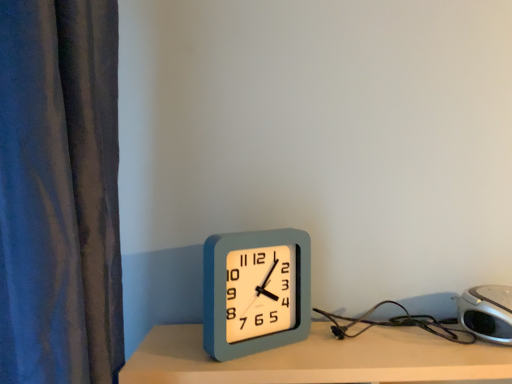
Question: Do you think light blue plastic clock at center, which ranks as the 1th alarm clock in left-to-right order, is within silver metallic alarm clock at lower right, which is the second alarm clock in left-to-right order, or outside of it?

Choices:
 (A) outside
 (B) inside

Answer: (A)

Question: Does point (282, 332) appear closer or farther from the camera than point (501, 306)?

Choices:
 (A) farther
 (B) closer

Answer: (A)

Question: From a real-world perspective, is light blue plastic clock at center, which ranks as the 1th alarm clock in left-to-right order, above or below silver metallic alarm clock at lower right, which is the second alarm clock in left-to-right order?

Choices:
 (A) below
 (B) above

Answer: (B)

Question: Is silver metallic alarm clock at lower right, which is the second alarm clock in left-to-right order, in front of or behind light blue plastic clock at center, positioned as the second alarm clock in right-to-left order, in the image?

Choices:
 (A) front
 (B) behind

Answer: (A)

Question: Visually, is silver metallic alarm clock at lower right, arranged as the first alarm clock when viewed from the right, positioned to the left or to the right of light blue plastic clock at center, positioned as the second alarm clock in right-to-left order?

Choices:
 (A) right
 (B) left

Answer: (A)

Question: Is silver metallic alarm clock at lower right, arranged as the first alarm clock when viewed from the right, wider or thinner than light blue plastic clock at center, positioned as the second alarm clock in right-to-left order?

Choices:
 (A) wide
 (B) thin

Answer: (A)

Question: From the image's perspective, is silver metallic alarm clock at lower right, arranged as the first alarm clock when viewed from the right, above or below light blue plastic clock at center, positioned as the second alarm clock in right-to-left order?

Choices:
 (A) below
 (B) above

Answer: (A)